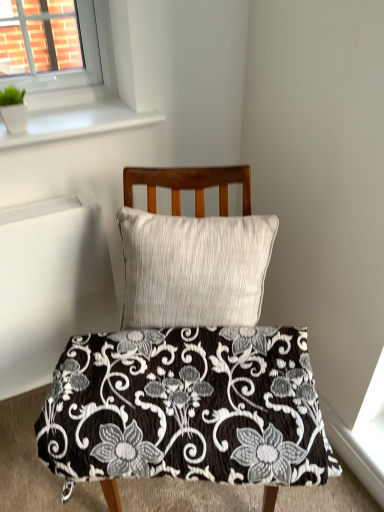
Question: Can you confirm if white ceramic pot at upper left is positioned to the right of white plastic radiator at left?

Choices:
 (A) no
 (B) yes

Answer: (A)

Question: Is white ceramic pot at upper left placed right next to white plastic radiator at left?

Choices:
 (A) yes
 (B) no

Answer: (B)

Question: Is white ceramic pot at upper left positioned behind white plastic radiator at left?

Choices:
 (A) no
 (B) yes

Answer: (B)

Question: Can you confirm if white ceramic pot at upper left is wider than white plastic radiator at left?

Choices:
 (A) yes
 (B) no

Answer: (B)

Question: From a real-world perspective, is white ceramic pot at upper left over white plastic radiator at left?

Choices:
 (A) no
 (B) yes

Answer: (B)

Question: Considering their positions, is white textured pillow at center located in front of or behind black quilted cushion at center?

Choices:
 (A) front
 (B) behind

Answer: (B)

Question: Considering the positions of white textured pillow at center and black quilted cushion at center in the image, is white textured pillow at center bigger or smaller than black quilted cushion at center?

Choices:
 (A) big
 (B) small

Answer: (B)

Question: Is white textured pillow at center taller or shorter than black quilted cushion at center?

Choices:
 (A) tall
 (B) short

Answer: (B)

Question: Is white textured pillow at center to the left or to the right of black quilted cushion at center in the image?

Choices:
 (A) left
 (B) right

Answer: (B)

Question: From the image's perspective, is white ceramic pot at upper left above or below black quilted cushion at center?

Choices:
 (A) above
 (B) below

Answer: (A)

Question: From a real-world perspective, is white ceramic pot at upper left above or below black quilted cushion at center?

Choices:
 (A) above
 (B) below

Answer: (A)

Question: Based on their positions, is white ceramic pot at upper left located to the left or right of black quilted cushion at center?

Choices:
 (A) right
 (B) left

Answer: (B)

Question: Looking at the image, does white ceramic pot at upper left seem bigger or smaller compared to black quilted cushion at center?

Choices:
 (A) big
 (B) small

Answer: (B)

Question: Considering the relative positions of white plastic window at upper left and white glossy window sill at upper left in the image provided, is white plastic window at upper left to the left or to the right of white glossy window sill at upper left?

Choices:
 (A) left
 (B) right

Answer: (A)

Question: Considering the positions of white plastic window at upper left and white glossy window sill at upper left in the image, is white plastic window at upper left taller or shorter than white glossy window sill at upper left?

Choices:
 (A) tall
 (B) short

Answer: (A)